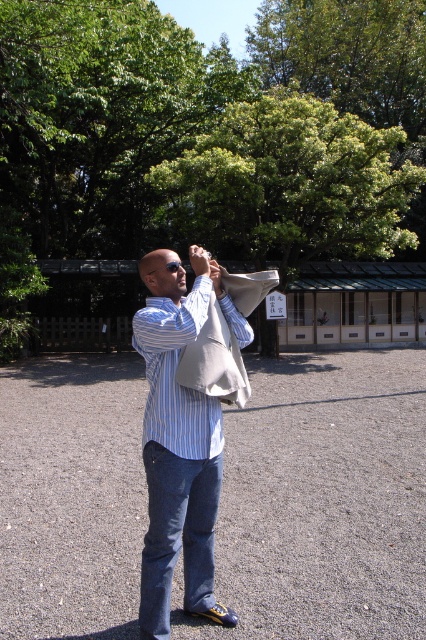
Looking at this image, can you confirm if matte blue shirt at center is thinner than blue striped shirt at center?

Indeed, matte blue shirt at center has a lesser width compared to blue striped shirt at center.

Between point (178, 490) and point (138, 340), which one is positioned behind?

Positioned behind is point (138, 340).

Is point (166, 369) closer to viewer compared to point (201, 324)?

No, it is not.

I want to click on matte blue shirt at center, so click(x=180, y=440).

Between matte blue shirt at center and denim at center, which one has more height?

denim at center is taller.

Is matte blue shirt at center closer to camera compared to denim at center?

Yes, it is.

Is point (195, 289) behind point (189, 548)?

No.

Identify the location of matte blue shirt at center. (180, 440).

Which is more to the right, denim at center or blue striped shirt at center?

blue striped shirt at center is more to the right.

Describe the element at coordinates (178, 534) in the screenshot. The height and width of the screenshot is (640, 426). I see `denim at center` at that location.

The height and width of the screenshot is (640, 426). In order to click on denim at center in this screenshot , I will do `click(178, 534)`.